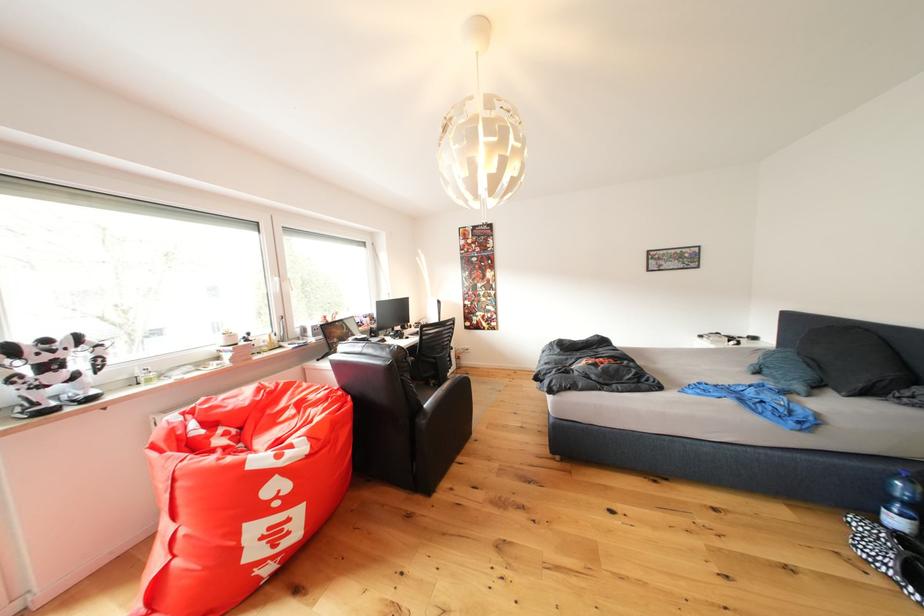
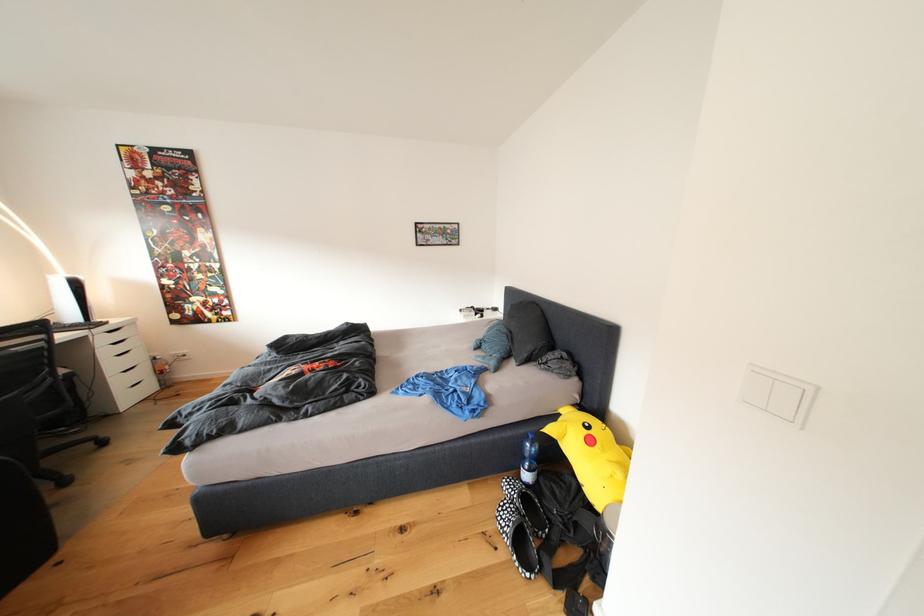
In the second image, find the point that corresponds to (895,488) in the first image.

(531, 451)